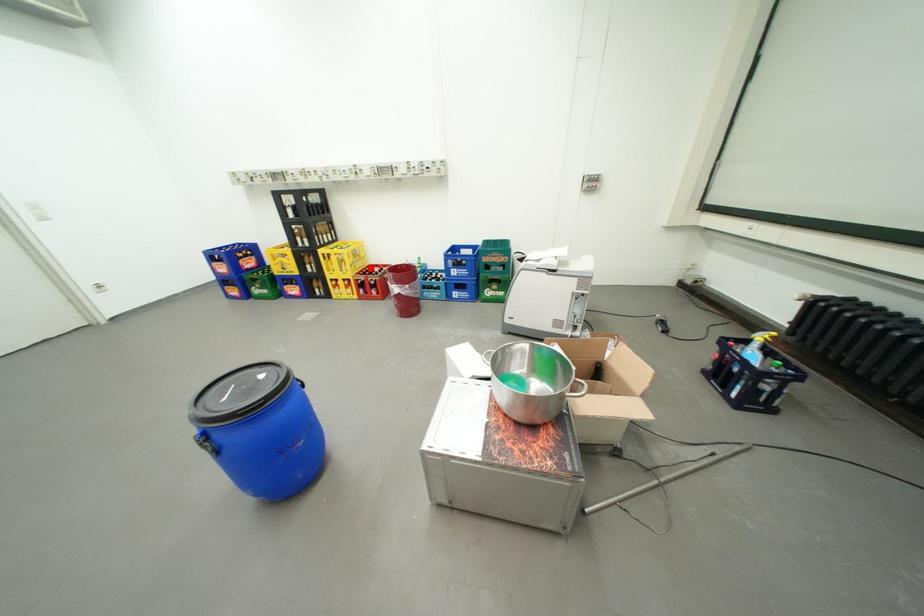
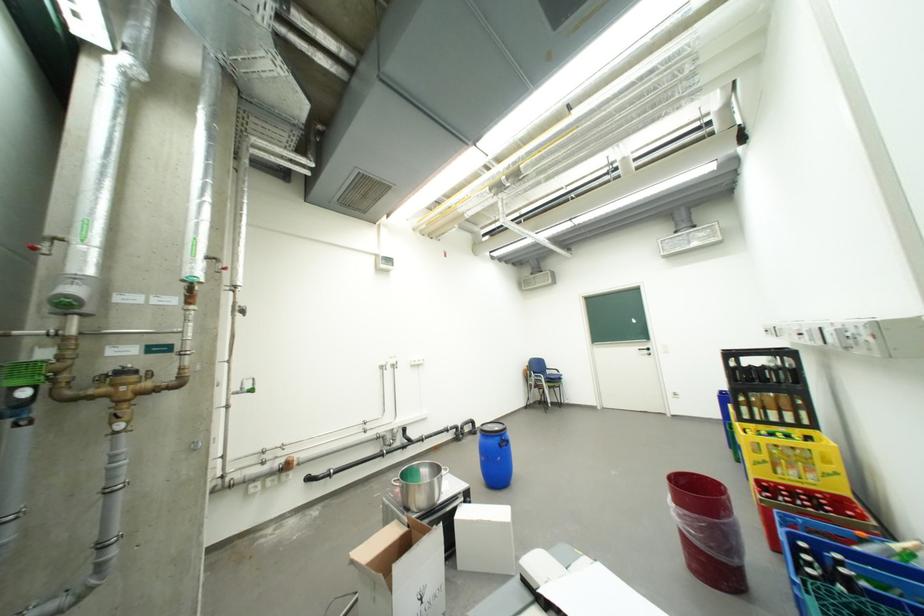
Question: I am providing you with two images of the same scene from different viewpoints. Given a red point in image1, look at the same physical point in image2. Is it:

Choices:
 (A) Closer to the viewpoint
 (B) Farther from the viewpoint

Answer: (A)